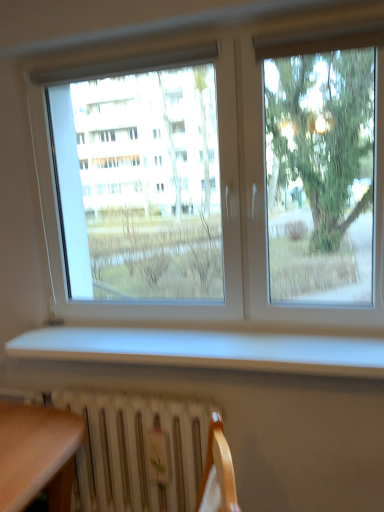
In order to face white metallic radiator at lower center, should I rotate leftwards or rightwards?

You should rotate left by 9.124 degrees.

The width and height of the screenshot is (384, 512). I want to click on white matte window sill at lower center, so click(x=205, y=349).

Image resolution: width=384 pixels, height=512 pixels. I want to click on white metallic radiator at lower center, so click(x=138, y=451).

Would you say white matte window sill at lower center is a long distance from white metallic radiator at lower center?

No, there isn't a large distance between white matte window sill at lower center and white metallic radiator at lower center.

Considering the relative positions of white matte window sill at lower center and white metallic radiator at lower center in the image provided, is white matte window sill at lower center behind white metallic radiator at lower center?

No, it is not.

Where is `radiator below the white matte window sill at lower center (from a real-world perspective)`? radiator below the white matte window sill at lower center (from a real-world perspective) is located at coordinates (138, 451).

From a real-world perspective, which is physically below, transparent glass window at center or white matte window sill at lower center?

white matte window sill at lower center.

In order to click on window sill in front of the transparent glass window at center in this screenshot , I will do `click(205, 349)`.

Does transparent glass window at center turn towards white matte window sill at lower center?

Yes, transparent glass window at center is turned towards white matte window sill at lower center.

Is transparent glass window at center bigger than white matte window sill at lower center?

Yes.

From a real-world perspective, which object stands above the other?

transparent glass window at center.

Does point (87, 416) come farther from viewer compared to point (300, 215)?

No, it is not.

Would you say white metallic radiator at lower center is to the left or to the right of transparent glass window at center in the picture?

Based on their positions, white metallic radiator at lower center is located to the left of transparent glass window at center.

Based on the photo, how much distance is there between white metallic radiator at lower center and transparent glass window at center?

2.18 meters.

Considering the points (169, 506) and (47, 348), which point is behind, point (169, 506) or point (47, 348)?

Positioned behind is point (169, 506).

Does white metallic radiator at lower center turn towards white matte window sill at lower center?

No, white metallic radiator at lower center does not turn towards white matte window sill at lower center.

In the scene shown: Measure the distance from white metallic radiator at lower center to white matte window sill at lower center.

white metallic radiator at lower center and white matte window sill at lower center are 14.94 inches apart.

Would you consider transparent glass window at center to be distant from white metallic radiator at lower center?

Yes.

Is transparent glass window at center further to camera compared to white metallic radiator at lower center?

That is False.

Between transparent glass window at center and white metallic radiator at lower center, which one has larger size?

transparent glass window at center.

Could you tell me if transparent glass window at center is facing white metallic radiator at lower center?

No, transparent glass window at center does not turn towards white metallic radiator at lower center.

Which is closer, (125, 358) or (363, 218)?

Positioned in front is point (125, 358).

From their relative heights in the image, would you say white matte window sill at lower center is taller or shorter than transparent glass window at center?

In the image, white matte window sill at lower center appears to be shorter than transparent glass window at center.

In the scene shown: Considering the relative positions of white matte window sill at lower center and transparent glass window at center in the image provided, is white matte window sill at lower center behind transparent glass window at center?

No, white matte window sill at lower center is closer to the viewer.

Is white matte window sill at lower center outside of transparent glass window at center?

Indeed, white matte window sill at lower center is completely outside transparent glass window at center.

Where is `radiator behind the white matte window sill at lower center`? The height and width of the screenshot is (512, 384). radiator behind the white matte window sill at lower center is located at coordinates (138, 451).

Identify the location of window sill that is in front of the transparent glass window at center. This screenshot has width=384, height=512. (205, 349).

Consider the image. Estimate the real-world distances between objects in this image. Which object is closer to transparent glass window at center, white metallic radiator at lower center or white matte window sill at lower center?

Among the two, white metallic radiator at lower center is located nearer to transparent glass window at center.

When comparing their distances from white matte window sill at lower center, does white metallic radiator at lower center or transparent glass window at center seem further?

transparent glass window at center is positioned further to the anchor white matte window sill at lower center.

When comparing their distances from white metallic radiator at lower center, does transparent glass window at center or white matte window sill at lower center seem closer?

white matte window sill at lower center is positioned closer to the anchor white metallic radiator at lower center.

From the image, which object appears to be farther from white matte window sill at lower center, transparent glass window at center or white metallic radiator at lower center?

transparent glass window at center is positioned further to the anchor white matte window sill at lower center.

Considering their positions, is white matte window sill at lower center positioned further to white metallic radiator at lower center than transparent glass window at center?

transparent glass window at center is further to white metallic radiator at lower center.

Considering their positions, is white matte window sill at lower center positioned closer to transparent glass window at center than white metallic radiator at lower center?

Among the two, white metallic radiator at lower center is located nearer to transparent glass window at center.

Where is `window sill between transparent glass window at center and white metallic radiator at lower center in the up-down direction`? window sill between transparent glass window at center and white metallic radiator at lower center in the up-down direction is located at coordinates (205, 349).